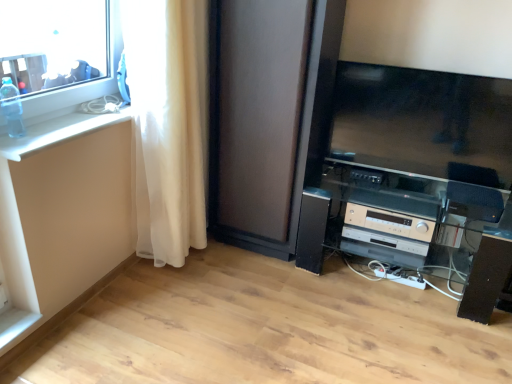
Where is `free space on the front side of matte black screen door at center`? The width and height of the screenshot is (512, 384). free space on the front side of matte black screen door at center is located at coordinates (258, 284).